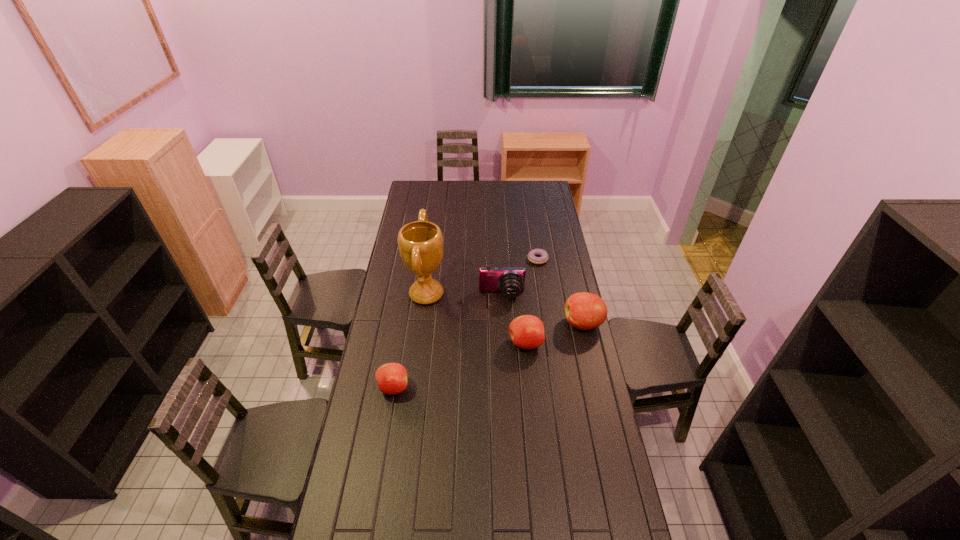
The image size is (960, 540). I want to click on vacant space located on the front of the rightmost object, so click(595, 374).

Locate an element on the screen. The width and height of the screenshot is (960, 540). vacant position located on the front of the tallest object with the decoration is located at coordinates (496, 294).

The image size is (960, 540). I want to click on vacant area situated on the front of the farthest object, so click(x=544, y=301).

At what (x,y) coordinates should I click in order to perform the action: click on vacant space located 0.290m on the front-facing side of the camera. Please return your answer as a coordinate pair (x, y). Looking at the image, I should click on (505, 352).

Find the location of a particular element. Image resolution: width=960 pixels, height=540 pixels. apple situated at the left edge is located at coordinates (391, 378).

The image size is (960, 540). In order to click on award at the left edge in this screenshot , I will do `click(420, 243)`.

At what (x,y) coordinates should I click in order to perform the action: click on apple that is at the right edge. Please return your answer as a coordinate pair (x, y). The image size is (960, 540). Looking at the image, I should click on (585, 311).

Where is `doughnut located in the right edge section of the desktop`? Image resolution: width=960 pixels, height=540 pixels. doughnut located in the right edge section of the desktop is located at coordinates (532, 254).

At what (x,y) coordinates should I click in order to perform the action: click on vacant space at the far edge of the desktop. Please return your answer as a coordinate pair (x, y). Image resolution: width=960 pixels, height=540 pixels. Looking at the image, I should click on (508, 191).

I want to click on free region at the near edge, so click(461, 531).